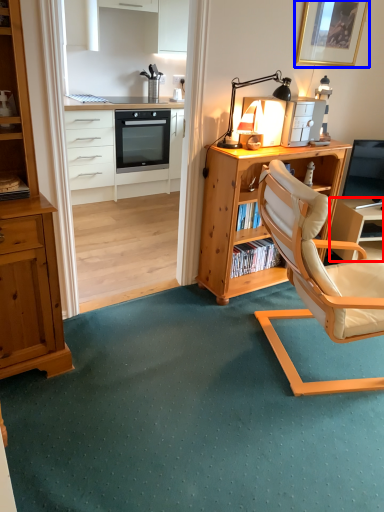
Question: Which point is further to the camera, table (highlighted by a red box) or picture frame (highlighted by a blue box)?

Choices:
 (A) table
 (B) picture frame

Answer: (A)